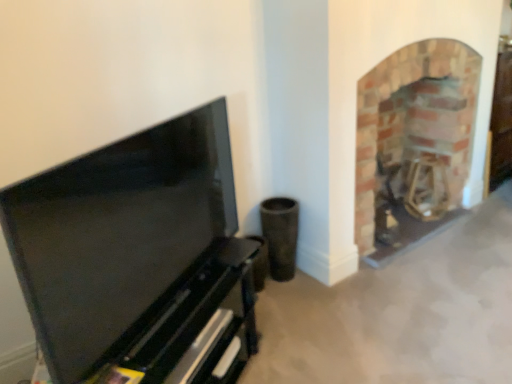
Question: Is brick fireplace at right bigger or smaller than matte black tv stand at left?

Choices:
 (A) small
 (B) big

Answer: (B)

Question: Considering their positions, is brick fireplace at right located in front of or behind matte black tv stand at left?

Choices:
 (A) behind
 (B) front

Answer: (A)

Question: From their relative heights in the image, would you say brick fireplace at right is taller or shorter than matte black tv stand at left?

Choices:
 (A) tall
 (B) short

Answer: (A)

Question: Considering the positions of matte black tv stand at left and brick fireplace at right in the image, is matte black tv stand at left taller or shorter than brick fireplace at right?

Choices:
 (A) short
 (B) tall

Answer: (A)

Question: From a real-world perspective, is matte black tv stand at left physically located above or below brick fireplace at right?

Choices:
 (A) above
 (B) below

Answer: (A)

Question: Is matte black tv stand at left inside the boundaries of brick fireplace at right, or outside?

Choices:
 (A) inside
 (B) outside

Answer: (B)

Question: Based on their positions, is matte black tv stand at left located to the left or right of brick fireplace at right?

Choices:
 (A) left
 (B) right

Answer: (A)